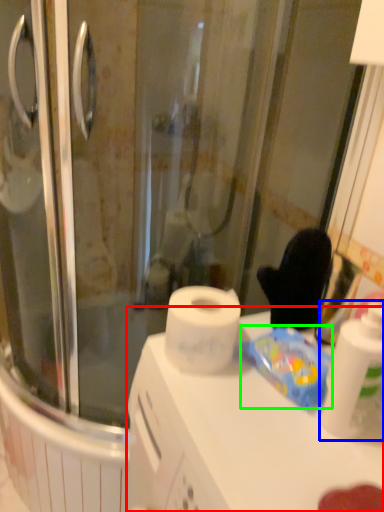
Question: Based on their relative distances, which object is nearer to counter top (highlighted by a red box)? Choose from cleaning product (highlighted by a blue box) and food (highlighted by a green box).

Choices:
 (A) cleaning product
 (B) food

Answer: (B)